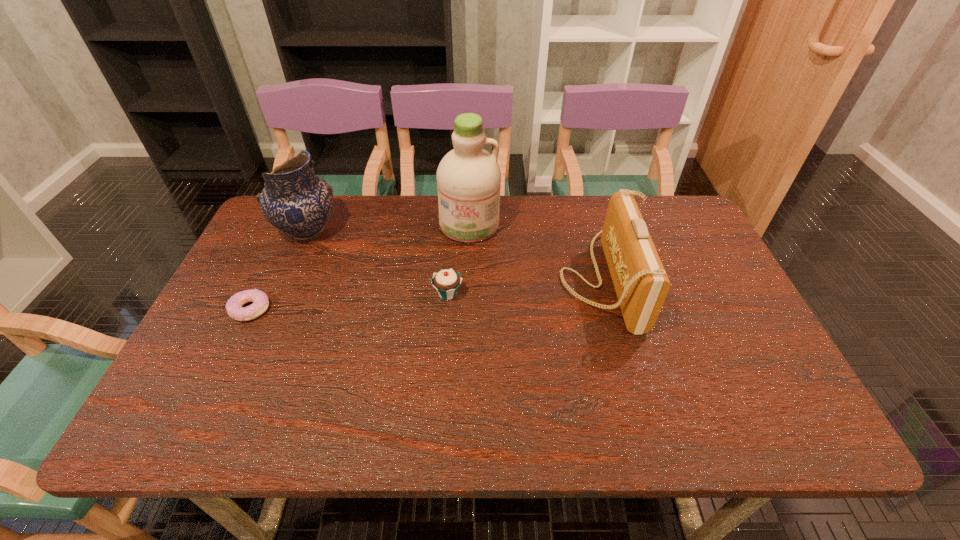
At what (x,y) coordinates should I click in order to perform the action: click on free region located 0.110m on the decorative side of the third tallest object. Please return your answer as a coordinate pair (x, y). Looking at the image, I should click on (519, 280).

You are a GUI agent. You are given a task and a screenshot of the screen. Output one action in this format:
    pyautogui.click(x=<x>, y=<y>)
    Task: Click on the vacant area situated 0.260m on the front of the cupcake
    The image size is (960, 540).
    Given the screenshot: What is the action you would take?
    pyautogui.click(x=441, y=395)

Identify the location of vacant space situated on the right of the shortest object. The image size is (960, 540). (379, 309).

In order to click on cleansing agent that is positioned at the far edge in this screenshot , I will do `click(468, 177)`.

At what (x,y) coordinates should I click in order to perform the action: click on pottery present at the far edge. Please return your answer as a coordinate pair (x, y). The height and width of the screenshot is (540, 960). Looking at the image, I should click on (296, 201).

Identify the location of handbag at the far edge. This screenshot has height=540, width=960. (640, 281).

This screenshot has height=540, width=960. Find the location of `pottery that is at the left edge`. pottery that is at the left edge is located at coordinates (296, 201).

Locate an element on the screen. Image resolution: width=960 pixels, height=540 pixels. doughnut located at the left edge is located at coordinates (234, 308).

The image size is (960, 540). What are the coordinates of `object located at the far left corner` in the screenshot? It's located at (296, 201).

Image resolution: width=960 pixels, height=540 pixels. In the image, there is a desktop. In order to click on vacant space at the far edge in this screenshot , I will do `click(403, 202)`.